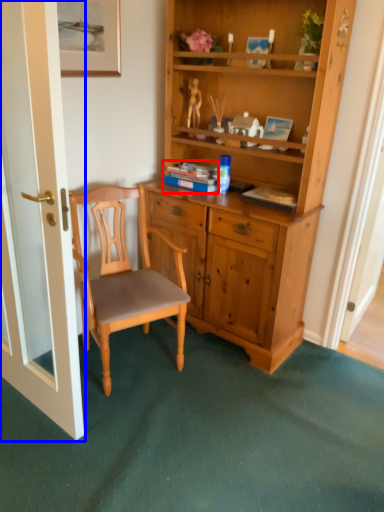
Question: Which object is further to the camera taking this photo, book (highlighted by a red box) or door (highlighted by a blue box)?

Choices:
 (A) book
 (B) door

Answer: (A)